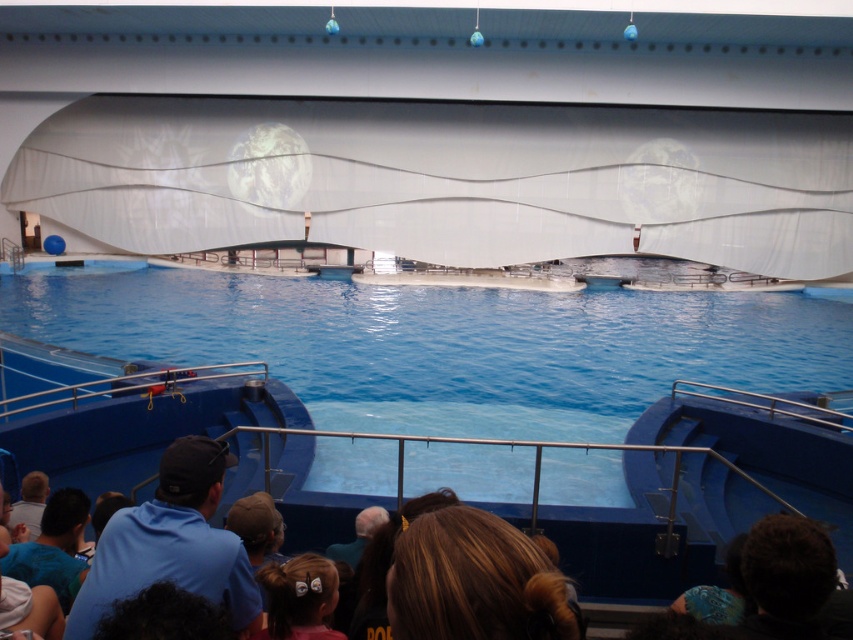
Consider the image. You are a visitor at the marine park and see two people in the exhibit area. One has dark brown hair at lower right and the other has brown hair at lower center. Which person is positioned more to the right side of the exhibit?

The dark brown hair at lower right is positioned more to the right side of the exhibit than the brown hair at lower center.

You are a visitor standing at the entrance of the aquatic exhibit. You notice two people observing the pool. One has dark brown hair at lower right and the other has brown hair at lower center. Which person is closer to you?

The dark brown hair at lower right is in front of the brown hair at lower center, so the person with dark brown hair at lower right is closer to you.